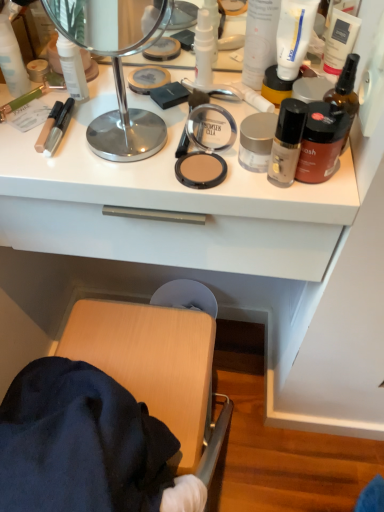
Locate an element on the screen. free space to the left of white matte spray bottle at center, which appears as the third toiletry when viewed from the left is located at coordinates (120, 91).